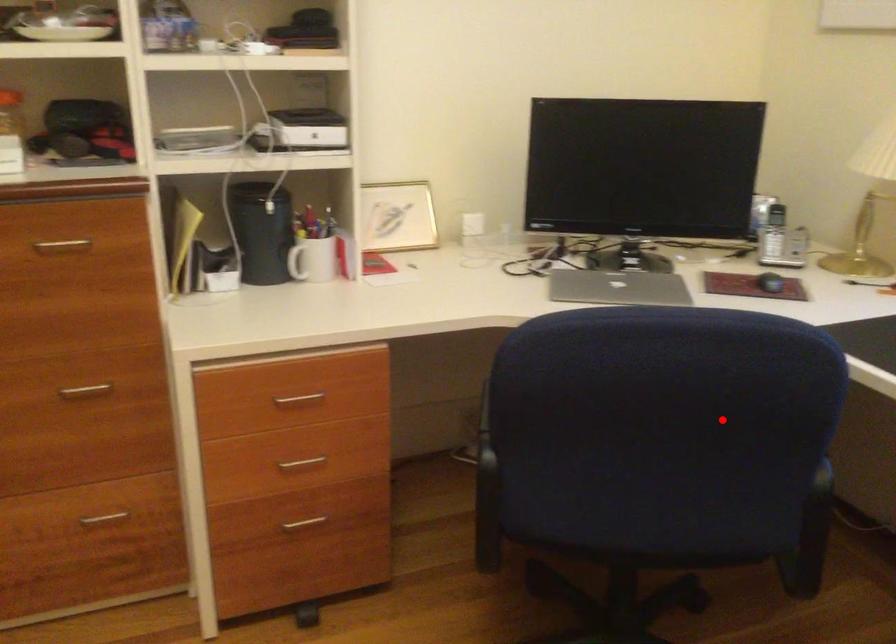
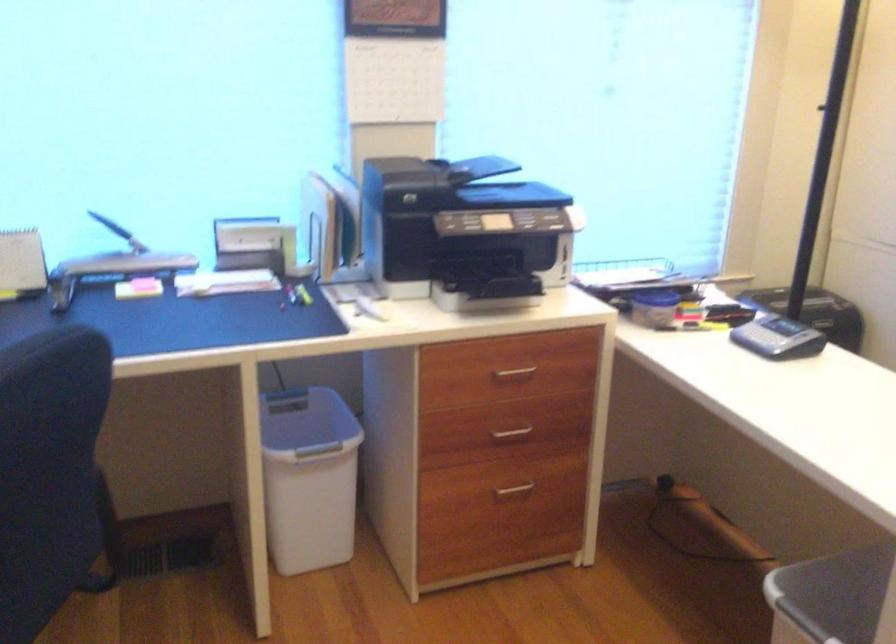
The point at the highlighted location is marked in the first image. Where is the corresponding point in the second image?

(48, 471)